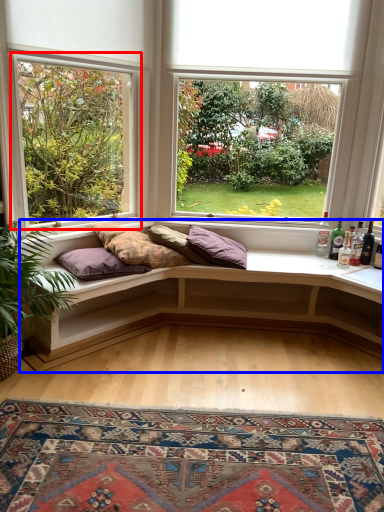
Question: Which of the following is the farthest to the observer, window (highlighted by a red box) or studio couch (highlighted by a blue box)?

Choices:
 (A) window
 (B) studio couch

Answer: (B)